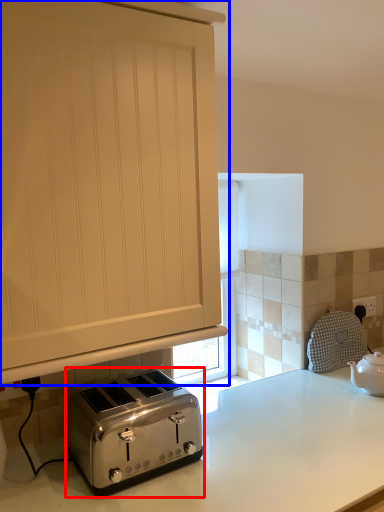
Question: Which of the following is the farthest to the observer, toaster (highlighted by a red box) or cabinetry (highlighted by a blue box)?

Choices:
 (A) toaster
 (B) cabinetry

Answer: (A)